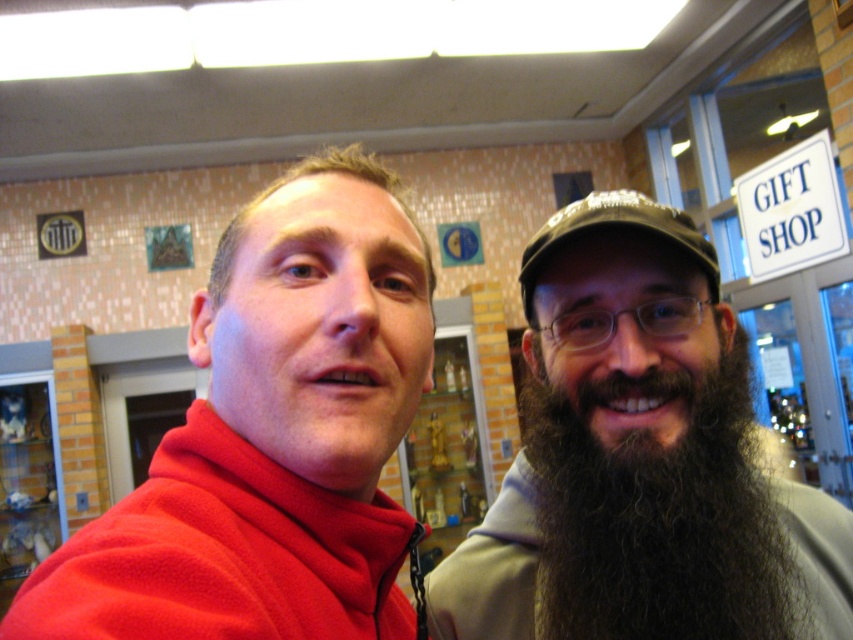
Question: Where is dark brown fuzzy beard at right located in relation to green fabric cap at upper right in the image?

Choices:
 (A) left
 (B) right

Answer: (B)

Question: Is matte fleece jacket at upper left to the left of dark brown fuzzy beard at right from the viewer's perspective?

Choices:
 (A) yes
 (B) no

Answer: (A)

Question: Can you confirm if matte fleece jacket at upper left is positioned to the left of dark brown fuzzy beard at right?

Choices:
 (A) yes
 (B) no

Answer: (A)

Question: Which point is closer to the camera taking this photo?

Choices:
 (A) (657, 337)
 (B) (576, 216)

Answer: (A)

Question: Which object appears closest to the camera in this image?

Choices:
 (A) dark brown beard at right
 (B) green fabric cap at upper right

Answer: (A)

Question: Considering the real-world distances, which object is farthest from the matte fleece jacket at upper left?

Choices:
 (A) dark brown fuzzy beard at right
 (B) green fabric cap at upper right

Answer: (B)